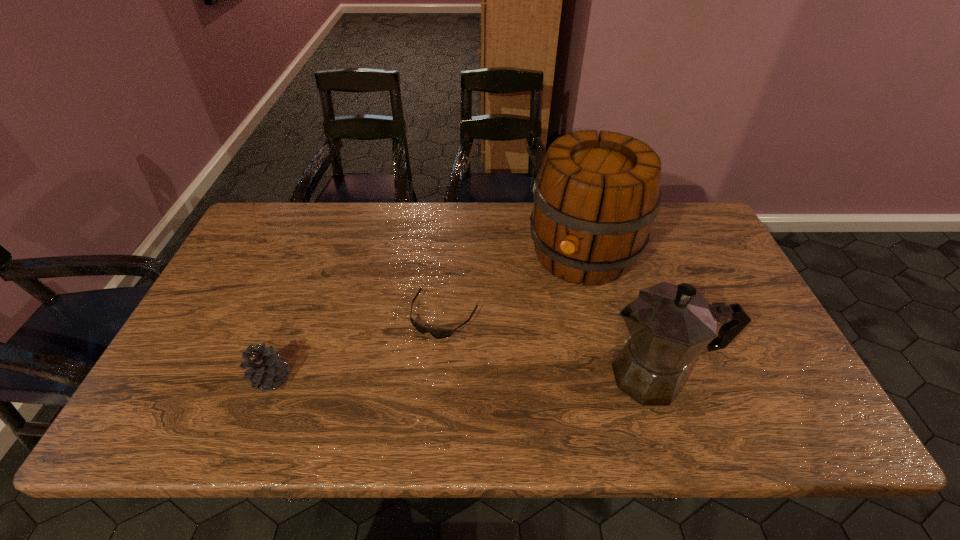
The image size is (960, 540). I want to click on vacant space that satisfies the following two spatial constraints: 1. on the front side of the second object from left to right; 2. on the pouring side of the coffeepot, so click(x=441, y=376).